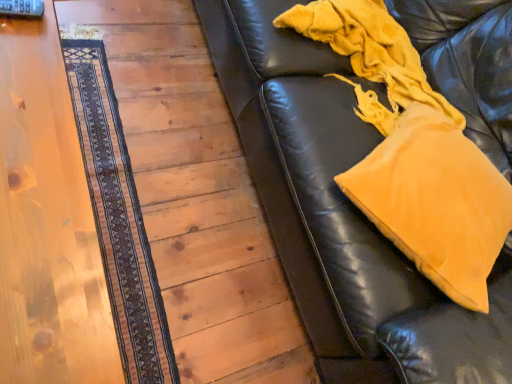
The height and width of the screenshot is (384, 512). I want to click on free space below dark brown woven mat at left (from a real-world perspective), so click(x=113, y=201).